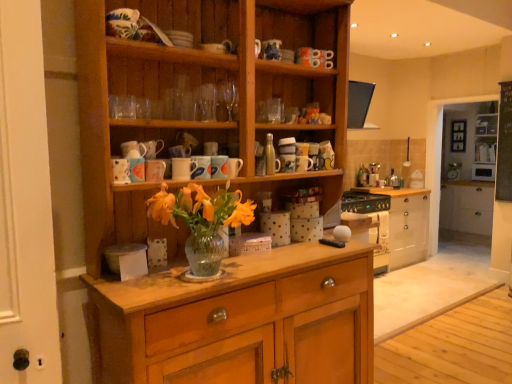
Question: Does white glossy cabinet at right, which is the first shelf from front to back, have a smaller size compared to white glossy mug at center, arranged as the 4th mug when viewed from the right?

Choices:
 (A) yes
 (B) no

Answer: (B)

Question: Is white glossy cabinet at right, which is counted as the second shelf, starting from the right, far from white glossy mug at center, arranged as the 4th mug when viewed from the right?

Choices:
 (A) no
 (B) yes

Answer: (B)

Question: Does white glossy cabinet at right, which is the first shelf from front to back, have a greater width compared to white glossy mug at center, marked as the third mug in a left-to-right arrangement?

Choices:
 (A) no
 (B) yes

Answer: (B)

Question: From a real-world perspective, is white glossy cabinet at right, which is counted as the 2th shelf, starting from the back, located higher than white glossy mug at center, arranged as the 4th mug when viewed from the right?

Choices:
 (A) yes
 (B) no

Answer: (B)

Question: From the image's perspective, is white glossy cabinet at right, which is the first shelf from front to back, located beneath white glossy mug at center, arranged as the 4th mug when viewed from the right?

Choices:
 (A) yes
 (B) no

Answer: (B)

Question: Is white glossy cabinet at right, which is the first shelf in left-to-right order, taller than white glossy mug at center, marked as the third mug in a left-to-right arrangement?

Choices:
 (A) no
 (B) yes

Answer: (B)

Question: Is matte ceramic mug at upper center, positioned as the first mug in left-to-right order, a part of white glossy cabinet at right, which is counted as the second shelf, starting from the right?

Choices:
 (A) no
 (B) yes

Answer: (A)

Question: Is white glossy cabinet at right, which is counted as the 2th shelf, starting from the back, at the right side of matte ceramic mug at upper center, acting as the sixth mug starting from the right?

Choices:
 (A) yes
 (B) no

Answer: (A)

Question: From the image's perspective, does white glossy cabinet at right, which is the first shelf in left-to-right order, appear lower than matte ceramic mug at upper center, acting as the sixth mug starting from the right?

Choices:
 (A) yes
 (B) no

Answer: (B)

Question: Considering the relative positions of white glossy cabinet at right, which is the first shelf in left-to-right order, and matte ceramic mug at upper center, acting as the sixth mug starting from the right, in the image provided, is white glossy cabinet at right, which is the first shelf in left-to-right order, behind matte ceramic mug at upper center, acting as the sixth mug starting from the right,?

Choices:
 (A) no
 (B) yes

Answer: (B)

Question: From a real-world perspective, is white glossy cabinet at right, which is the first shelf from front to back, positioned under matte ceramic mug at upper center, positioned as the first mug in left-to-right order, based on gravity?

Choices:
 (A) no
 (B) yes

Answer: (B)

Question: Considering the relative sizes of white glossy cabinet at right, which is the first shelf in left-to-right order, and matte ceramic mug at upper center, positioned as the first mug in left-to-right order, in the image provided, is white glossy cabinet at right, which is the first shelf in left-to-right order, wider than matte ceramic mug at upper center, positioned as the first mug in left-to-right order,?

Choices:
 (A) no
 (B) yes

Answer: (B)

Question: Is white glossy cabinet at right, which is counted as the 2th shelf, starting from the back, facing away from glossy ceramic mug at upper center, which ranks as the fifth mug in left-to-right order?

Choices:
 (A) no
 (B) yes

Answer: (A)